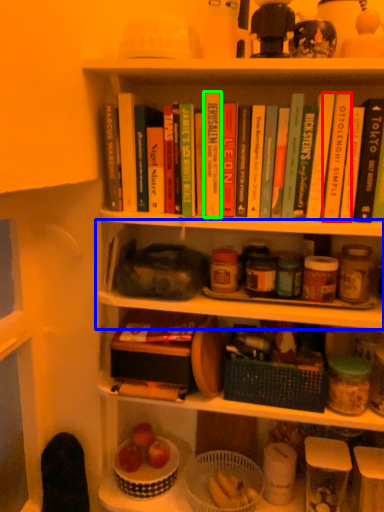
Question: Which is nearer to the paperback book (highlighted by a red box)? shelf (highlighted by a blue box) or paperback book (highlighted by a green box).

Choices:
 (A) shelf
 (B) paperback book

Answer: (B)